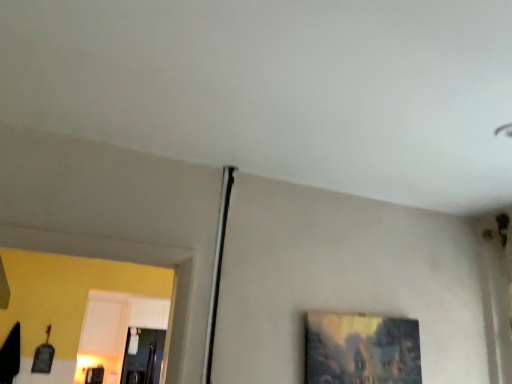
Question: Should I look upward or downward to see transparent glass door at lower left?

Choices:
 (A) down
 (B) up

Answer: (A)

Question: From a real-world perspective, does transparent glass door at lower left stand above matte wooden picture frame at lower right?

Choices:
 (A) no
 (B) yes

Answer: (A)

Question: Is transparent glass door at lower left bigger than matte wooden picture frame at lower right?

Choices:
 (A) yes
 (B) no

Answer: (A)

Question: Does transparent glass door at lower left have a greater width compared to matte wooden picture frame at lower right?

Choices:
 (A) no
 (B) yes

Answer: (B)

Question: Are transparent glass door at lower left and matte wooden picture frame at lower right located far from each other?

Choices:
 (A) no
 (B) yes

Answer: (B)

Question: Can you confirm if transparent glass door at lower left is positioned to the left of matte wooden picture frame at lower right?

Choices:
 (A) no
 (B) yes

Answer: (B)

Question: Is transparent glass door at lower left not within matte wooden picture frame at lower right?

Choices:
 (A) yes
 (B) no

Answer: (A)

Question: Does matte wooden picture frame at lower right lie behind transparent glass door at lower left?

Choices:
 (A) no
 (B) yes

Answer: (A)

Question: Does matte wooden picture frame at lower right touch transparent glass door at lower left?

Choices:
 (A) yes
 (B) no

Answer: (B)

Question: From a real-world perspective, does matte wooden picture frame at lower right sit lower than transparent glass door at lower left?

Choices:
 (A) yes
 (B) no

Answer: (B)

Question: Can you confirm if matte wooden picture frame at lower right is wider than transparent glass door at lower left?

Choices:
 (A) yes
 (B) no

Answer: (B)

Question: Is matte wooden picture frame at lower right shorter than transparent glass door at lower left?

Choices:
 (A) no
 (B) yes

Answer: (B)

Question: From the image's perspective, is matte wooden picture frame at lower right above transparent glass door at lower left?

Choices:
 (A) yes
 (B) no

Answer: (A)

Question: Do you think matte wooden picture frame at lower right is within transparent glass door at lower left, or outside of it?

Choices:
 (A) outside
 (B) inside

Answer: (A)